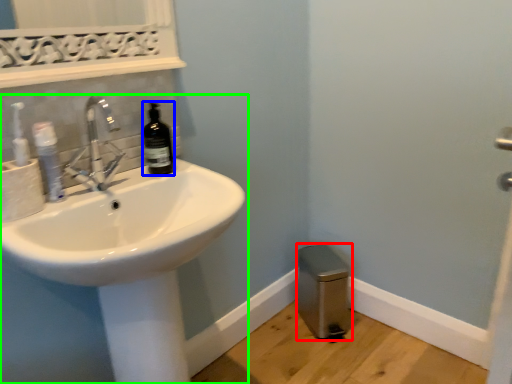
Question: Estimate the real-world distances between objects in this image. Which object is closer to bidet (highlighted by a red box), bottle (highlighted by a blue box) or sink (highlighted by a green box)?

Choices:
 (A) bottle
 (B) sink

Answer: (B)